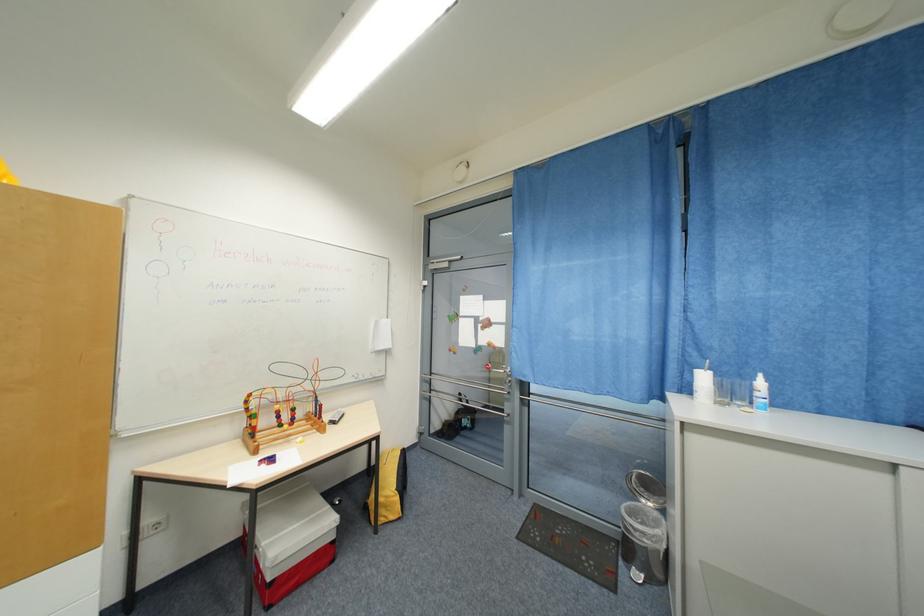
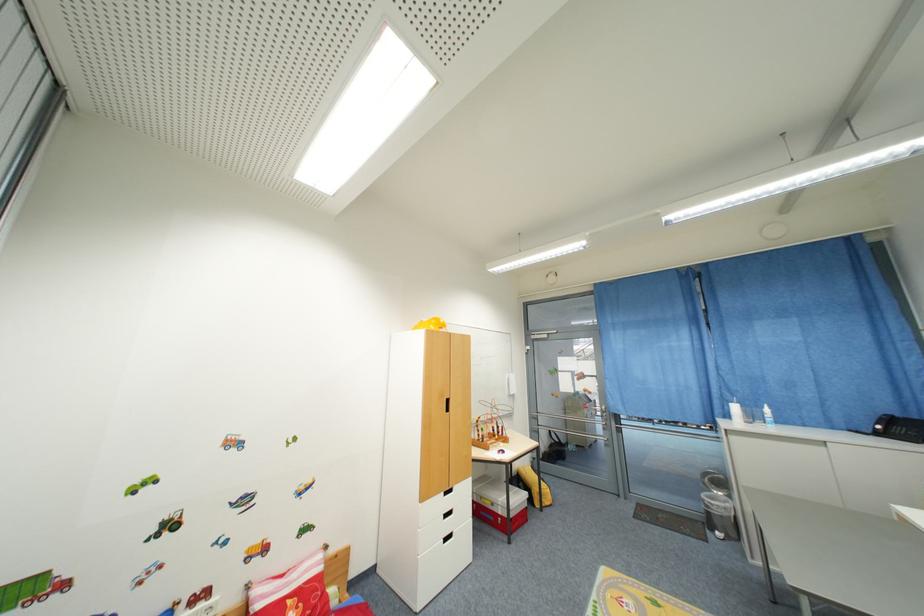
Locate, in the second image, the point that corresponds to (709,379) in the first image.

(740, 410)